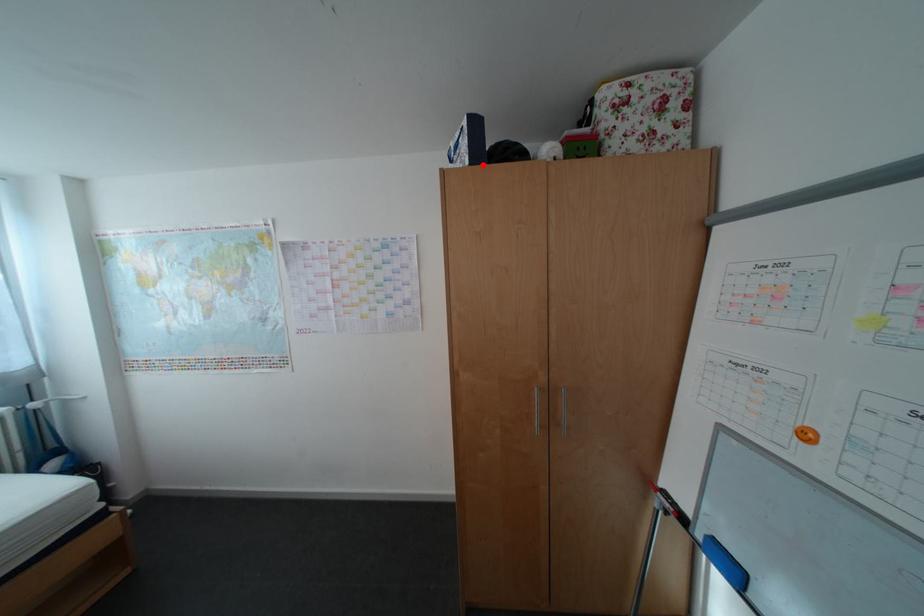
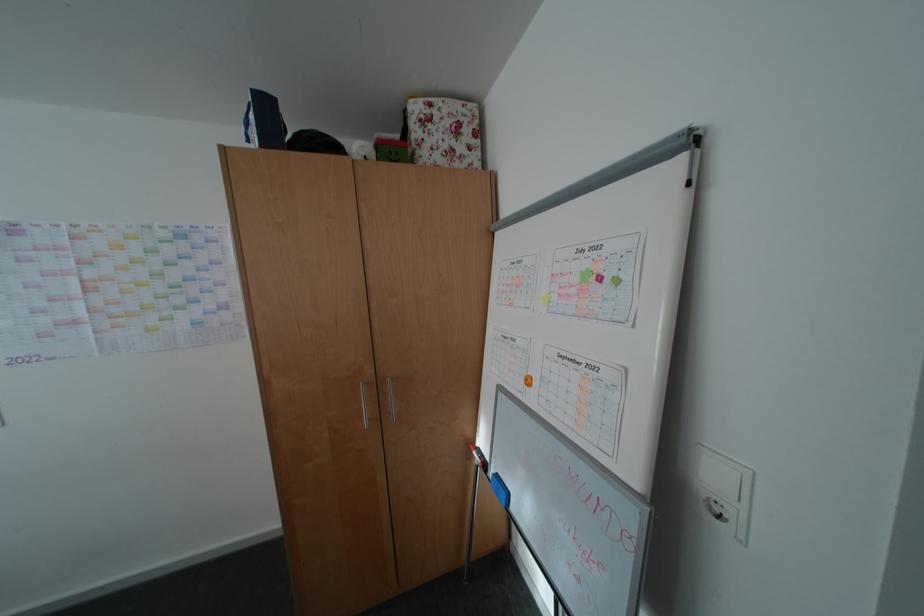
In the second image, find the point that corresponds to the highlighted location in the first image.

(274, 148)